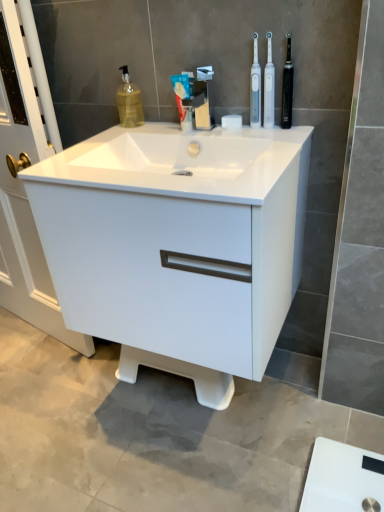
The image size is (384, 512). In order to click on empty space that is to the right of satin nickel faucet at center in this screenshot , I will do `click(256, 135)`.